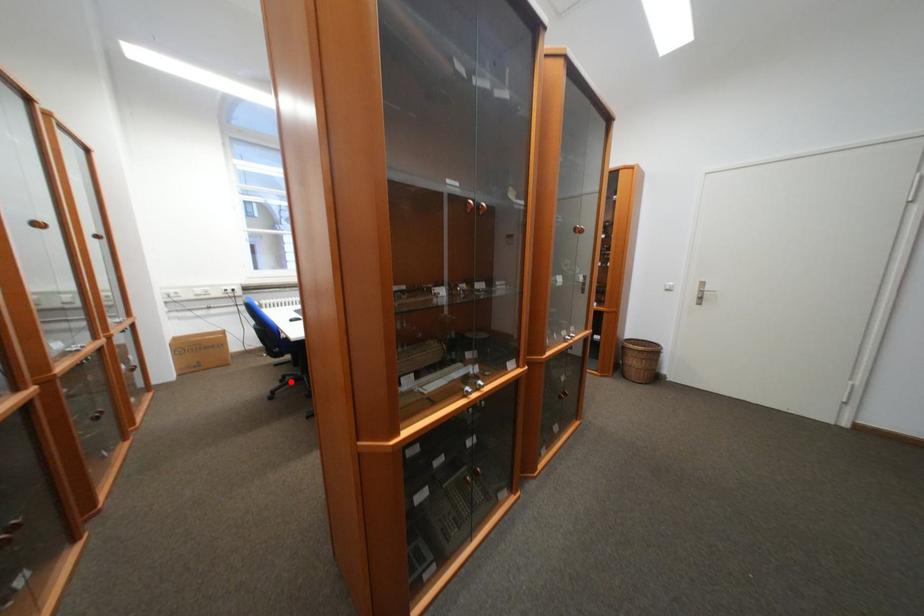
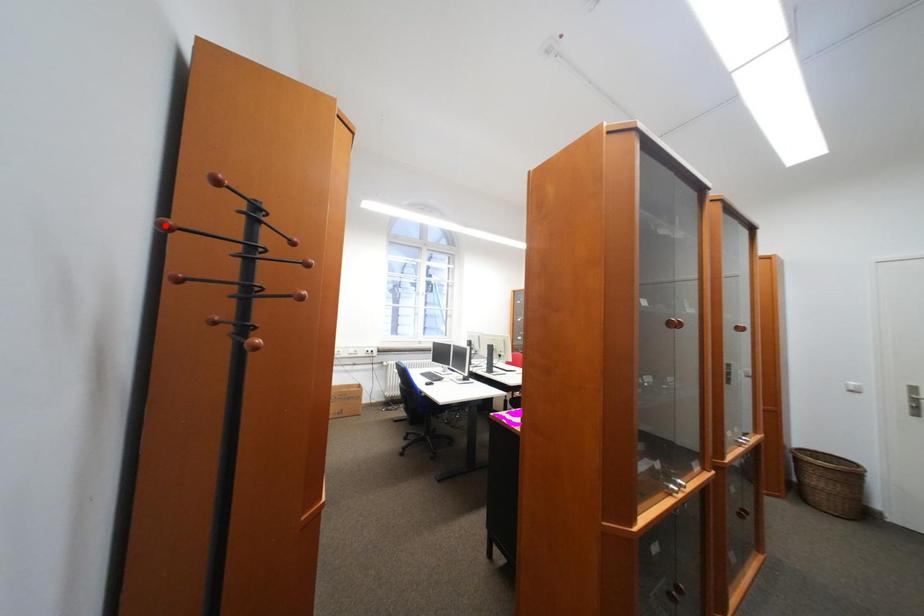
I am providing you with two images of the same scene from different viewpoints. A red point is marked on the first image and another point is marked on the second image. Is the marked point in image1 the same physical position as the marked point in image2?

No